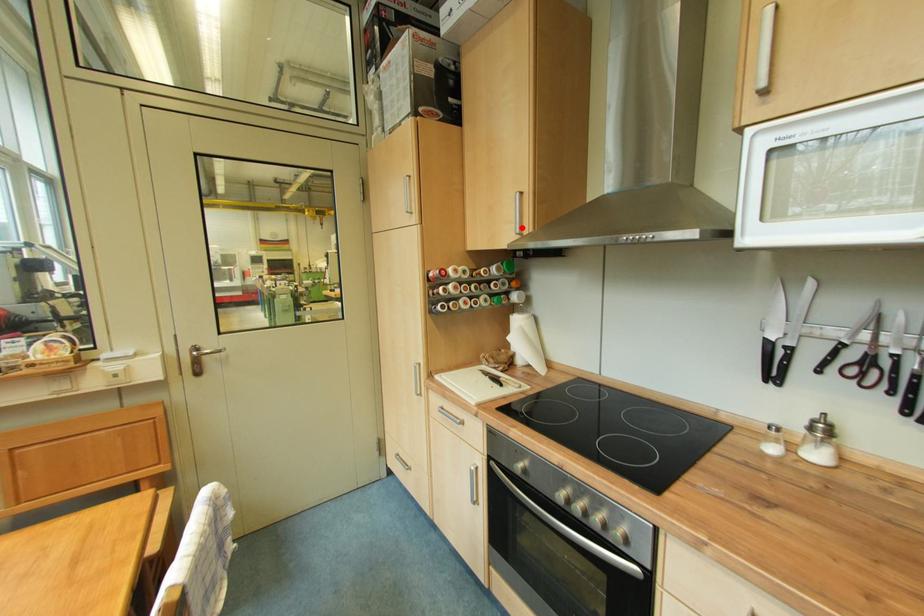
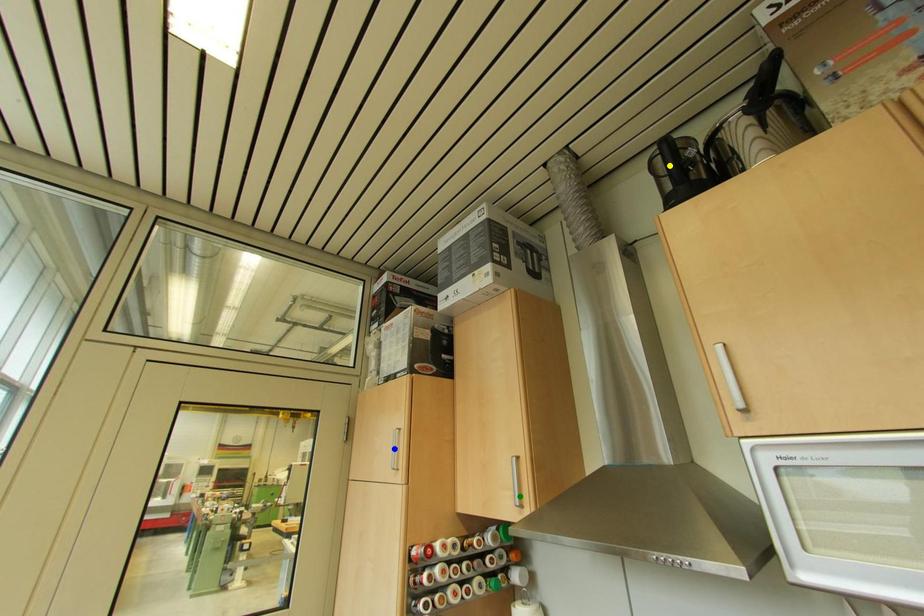
Question: I am providing you with two images of the same scene from different viewpoints. A red point is marked on the first image. You are given multiple points on the second image. In image 2, which mark is for the same physical point as the one in image 1?

Choices:
 (A) blue point
 (B) green point
 (C) yellow point

Answer: (B)